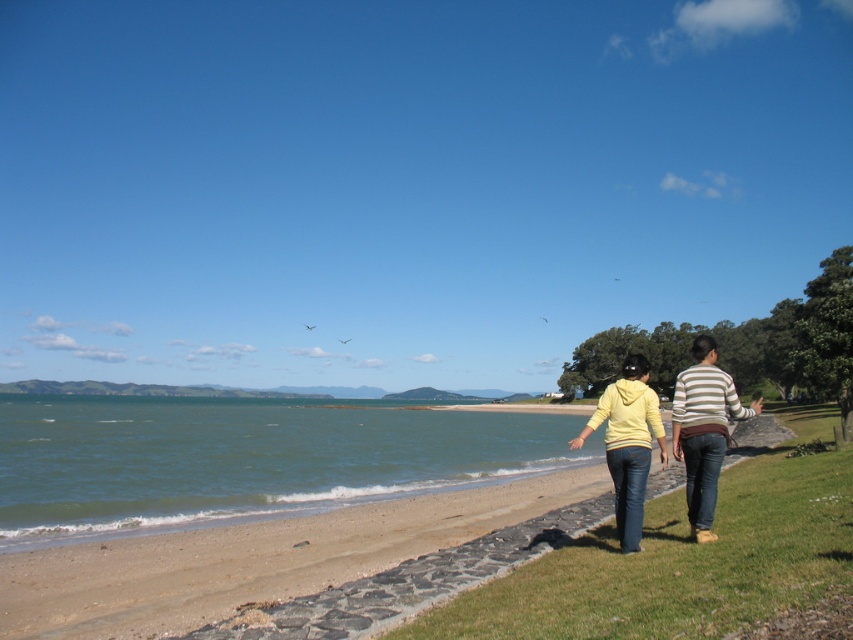
You are a photographer standing on the sandy beach at lower left and want to take a photo of the yellow matte hoodie at lower right. Considering the height of the beach and the hoodie, will you need to adjust your camera angle upwards or downwards to capture the hoodie properly?

The sandy beach at lower left is not as tall as the yellow matte hoodie at lower right, so you will need to adjust your camera angle upwards to capture the hoodie properly.

You are a photographer positioned at the edge of the stone pathway. You want to capture a photo of both the yellow hoodie at center and the yellow matte hoodie at lower right in the same frame. Based on their positions, which one is closer to the left side of the photo?

The yellow hoodie at center is positioned to the left of the yellow matte hoodie at lower right, so the yellow hoodie at center will appear closer to the left side of the photo.